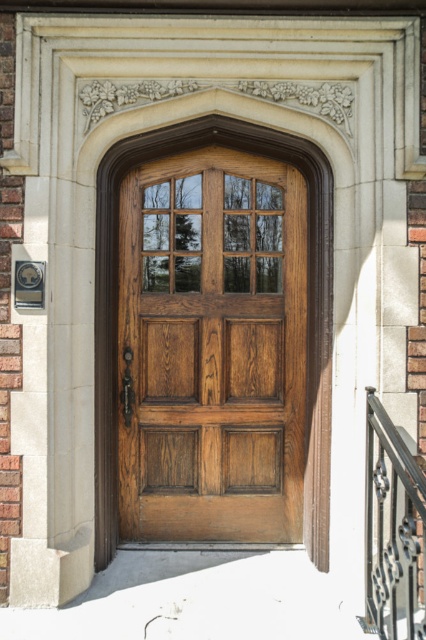
You are standing in front of the wooden door at center and want to reach the black wrought iron railing at lower right. In which direction should you move relative to the door?

The wooden door at center is to the left of the black wrought iron railing at lower right, so you should move to the right relative to the door to reach the railing.

You are a painter who needs to decide which object to paint first. The wooden door at center and the black wrought iron railing at lower right are both in your current view. Based on their sizes, which one should you paint first if you want to start with the taller object?

The wooden door at center is taller than the black wrought iron railing at lower right, so you should paint the wooden door at center first.